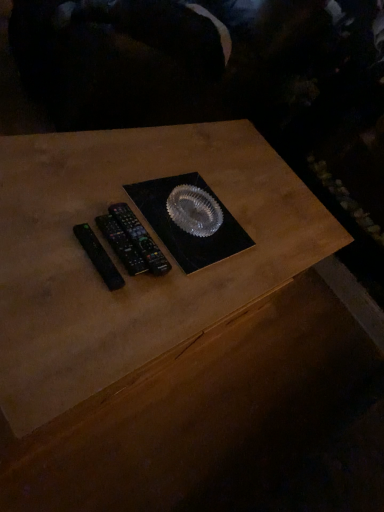
Where is `vacant space behind black plastic remote controls at center, which is the 1th control from back to front`? This screenshot has height=512, width=384. vacant space behind black plastic remote controls at center, which is the 1th control from back to front is located at coordinates 147,202.